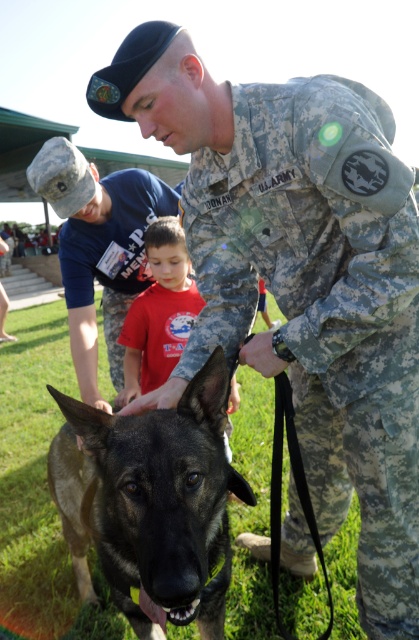
You are a photographer at the event and want to take a photo of the dark brown fur dog at center and the red cotton shirt at center. Based on their positions, which object is located to the left?

The red cotton shirt at center is located to the left of the dark brown fur dog at center.

You are a photographer at the event and need to position the two subjects so that their tops are visible. Given that the camouflage uniform at center and the red cotton shirt at center are in the same frame, which one should you focus on to ensure the top is fully visible without cropping?

The camouflage uniform at center is taller than the red cotton shirt at center, so focusing on the camouflage uniform at center ensures the top is fully visible without cropping.

Based on the scene description, can you determine which object is bigger between the dark brown fur dog at center and the camouflage uniform at center?

The dark brown fur dog at center is larger in size than the camouflage uniform at center.